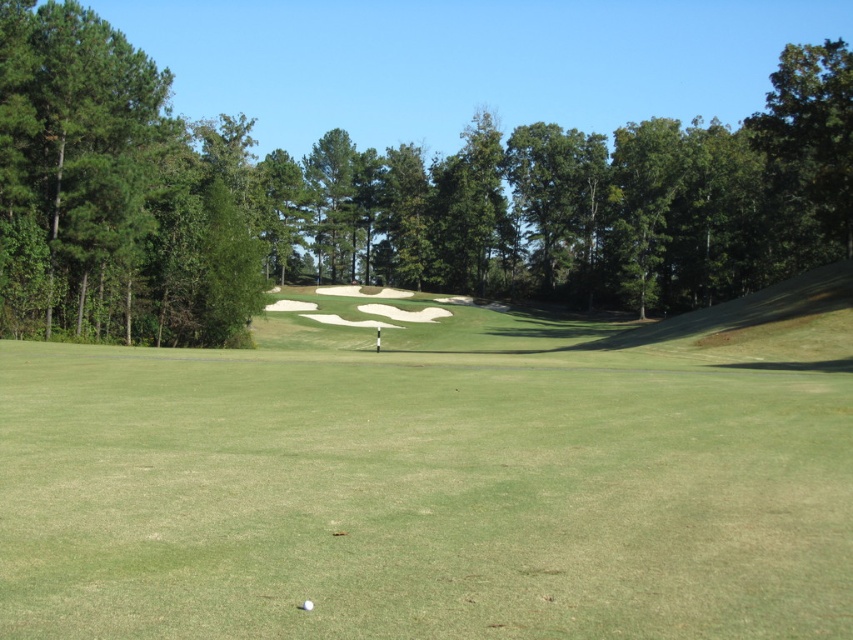
Question: Based on their relative distances, which object is farther from the green leafy tree at center?

Choices:
 (A) white matte golf ball at center
 (B) green grassy field at center

Answer: (A)

Question: Is green leafy tree at center further to camera compared to white matte golf ball at center?

Choices:
 (A) no
 (B) yes

Answer: (B)

Question: Is green grassy field at center above green leafy tree at center?

Choices:
 (A) yes
 (B) no

Answer: (B)

Question: Is green leafy tree at center wider than white matte golf ball at center?

Choices:
 (A) yes
 (B) no

Answer: (A)

Question: Which point appears closest to the camera in this image?

Choices:
 (A) (47, 628)
 (B) (230, 257)
 (C) (311, 605)

Answer: (A)

Question: Which point is closer to the camera taking this photo?

Choices:
 (A) (308, 609)
 (B) (292, 480)

Answer: (A)